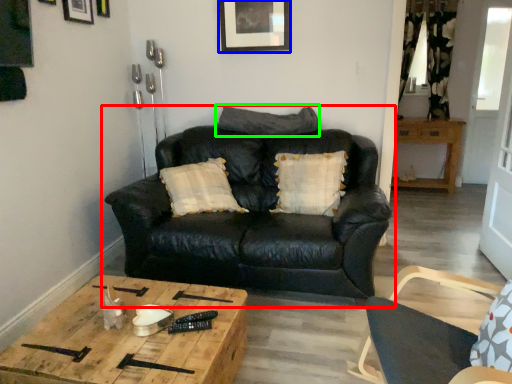
Question: Based on their relative distances, which object is nearer to studio couch (highlighted by a red box)? Choose from picture frame (highlighted by a blue box) and pillow (highlighted by a green box).

Choices:
 (A) picture frame
 (B) pillow

Answer: (B)